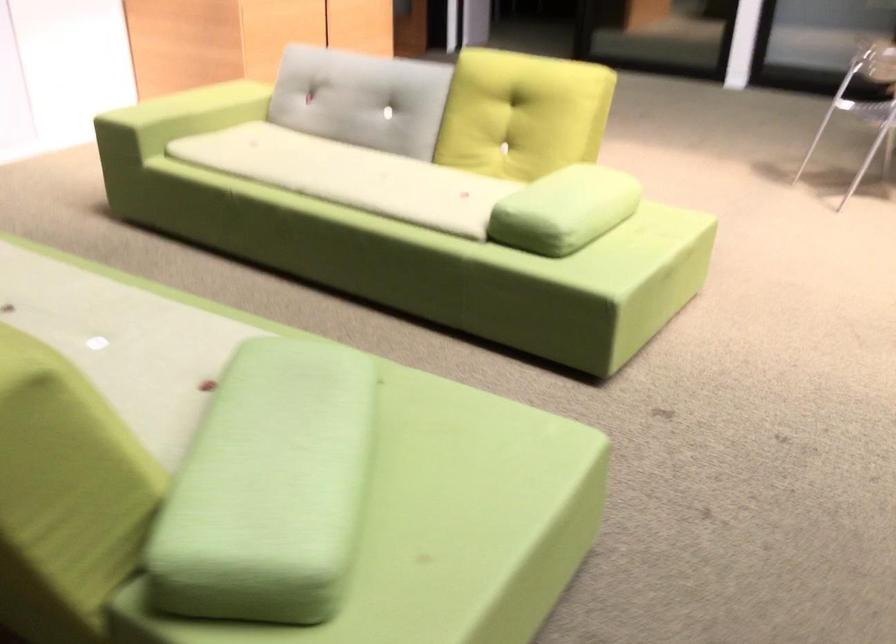
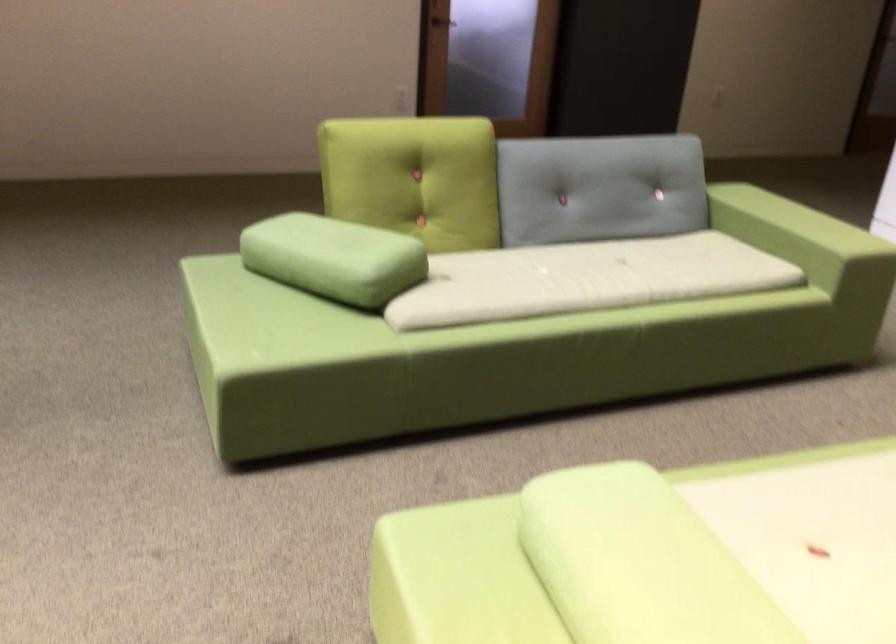
Locate, in the second image, the point that corresponds to (300,333) in the first image.

(504, 334)